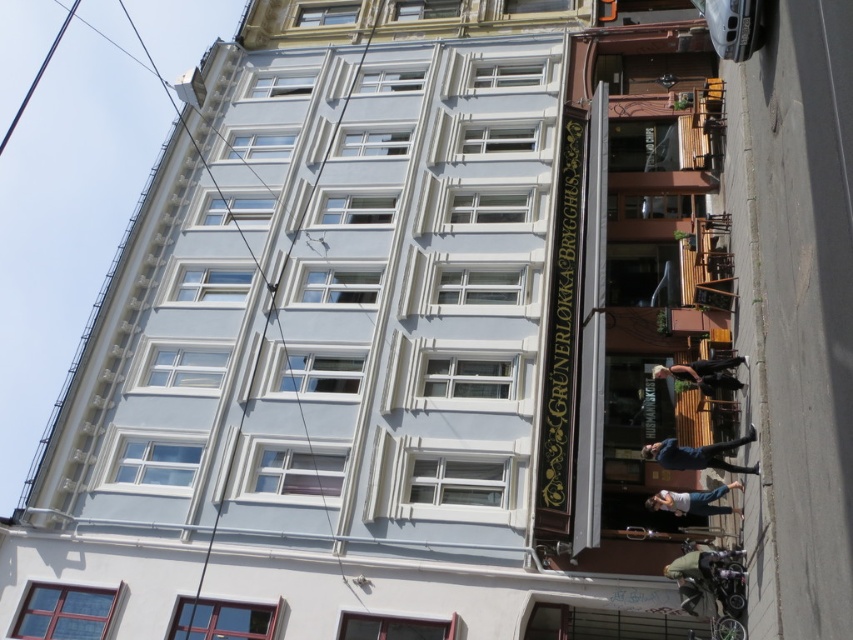
Which is more to the left, blue denim jacket at lower center or light blue jeans at lower center?

light blue jeans at lower center

Is blue denim jacket at lower center thinner than light blue jeans at lower center?

In fact, blue denim jacket at lower center might be wider than light blue jeans at lower center.

Between point (712, 464) and point (654, 499), which one is positioned behind?

Point (654, 499)

The width and height of the screenshot is (853, 640). What are the coordinates of `blue denim jacket at lower center` in the screenshot? It's located at (697, 454).

Is green fabric jacket at lower right wider than light blue jeans at lower center?

Incorrect, green fabric jacket at lower right's width does not surpass light blue jeans at lower center's.

In the scene shown: Is green fabric jacket at lower right positioned behind light blue jeans at lower center?

No, it is in front of light blue jeans at lower center.

Is point (701, 595) closer to camera compared to point (683, 493)?

Yes, point (701, 595) is closer to viewer.

Locate an element on the screen. This screenshot has width=853, height=640. green fabric jacket at lower right is located at coordinates (709, 579).

Can you confirm if dark blue jeans at center is positioned to the right of light blue jeans at lower center?

Indeed, dark blue jeans at center is positioned on the right side of light blue jeans at lower center.

Consider the image. Which is below, dark blue jeans at center or light blue jeans at lower center?

light blue jeans at lower center is lower down.

Image resolution: width=853 pixels, height=640 pixels. Find the location of `dark blue jeans at center`. dark blue jeans at center is located at coordinates (703, 372).